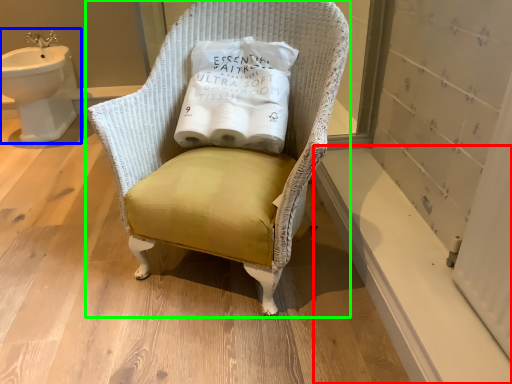
Question: Which object is the closest to the window sill (highlighted by a red box)? Choose among these: sink (highlighted by a blue box) or chair (highlighted by a green box).

Choices:
 (A) sink
 (B) chair

Answer: (B)